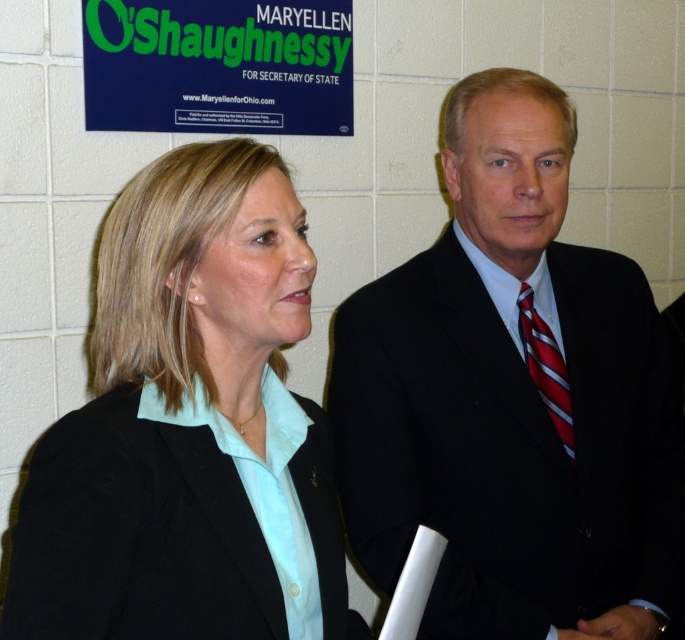
Which is more to the right, matte black blazer at center or green plastic signboard at upper left?

matte black blazer at center is more to the right.

The height and width of the screenshot is (640, 685). What do you see at coordinates (186, 426) in the screenshot?
I see `matte black blazer at center` at bounding box center [186, 426].

Does point (114, 417) come farther from viewer compared to point (349, 88)?

No, (114, 417) is closer to viewer.

At what (x,y) coordinates should I click in order to perform the action: click on matte black blazer at center. Please return your answer as a coordinate pair (x, y). Looking at the image, I should click on (186, 426).

In the scene shown: Can you confirm if black suit at center is wider than green plastic signboard at upper left?

Indeed, black suit at center has a greater width compared to green plastic signboard at upper left.

Who is more forward, (473, 291) or (211, 3)?

Positioned in front is point (473, 291).

Locate an element on the screen. The image size is (685, 640). black suit at center is located at coordinates (512, 397).

The image size is (685, 640). What do you see at coordinates (512, 397) in the screenshot?
I see `black suit at center` at bounding box center [512, 397].

Who is lower down, black suit at center or matte black blazer at center?

matte black blazer at center is below.

Between point (464, 237) and point (247, 170), which one is positioned behind?

Point (464, 237)

You are a GUI agent. You are given a task and a screenshot of the screen. Output one action in this format:
    pyautogui.click(x=<x>, y=<y>)
    Task: Click on the black suit at center
    Image resolution: width=685 pixels, height=640 pixels.
    Given the screenshot: What is the action you would take?
    pyautogui.click(x=512, y=397)